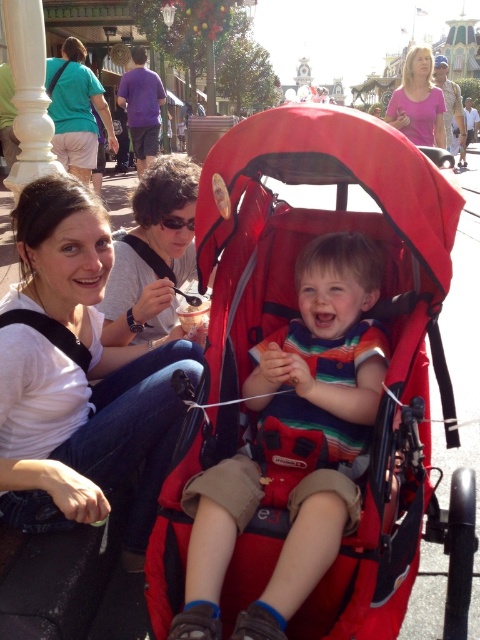
You are standing at the camera position and want to hand a small toy to the child wearing the striped cotton shirt at center. Considering the distance, can you comfortably reach the child without moving closer?

The striped cotton shirt at center is 4.86 meters away from the camera. Since this distance is too far for a comfortable reach without moving closer, you cannot hand the toy directly from the current position.

You are standing at the entrance of the theme park and see the matte white shirt at upper left in the distance. If you want to reach it quickly, should you walk straight ahead or turn left?

The matte white shirt at upper left is 12.67 meters away from you. Since it is at upper left in the image, you should turn left to head towards it.